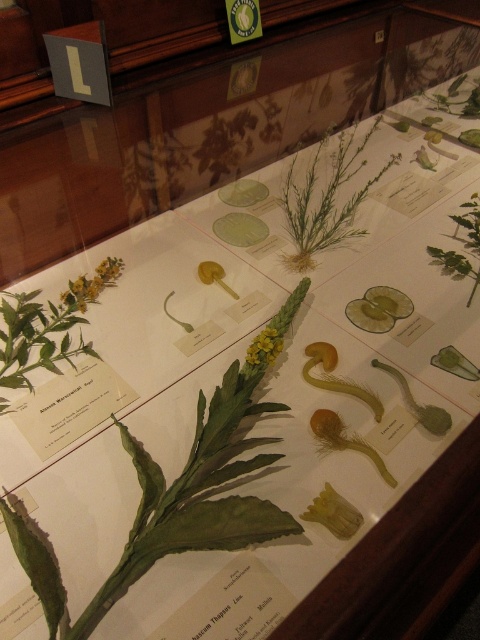
Question: Which of the following is the farthest from the observer?

Choices:
 (A) (368, 188)
 (B) (439, 250)
 (C) (261, 346)
 (D) (96, 285)

Answer: (A)

Question: Which object is closer to the camera taking this photo?

Choices:
 (A) yellow matte flower at center
 (B) green matte plant at center
 (C) green matte leaf at center

Answer: (A)

Question: Is yellow matte flower at upper left thinner than yellow matte flower at center?

Choices:
 (A) no
 (B) yes

Answer: (A)

Question: Based on their relative distances, which object is farther from the yellow matte flower at center?

Choices:
 (A) green matte plant at center
 (B) yellow matte flower at upper left

Answer: (A)

Question: Can you confirm if green matte plant at center is positioned to the left of green matte leaf at center?

Choices:
 (A) no
 (B) yes

Answer: (B)

Question: Does yellow matte flower at upper left appear on the right side of yellow matte flower at center?

Choices:
 (A) no
 (B) yes

Answer: (A)